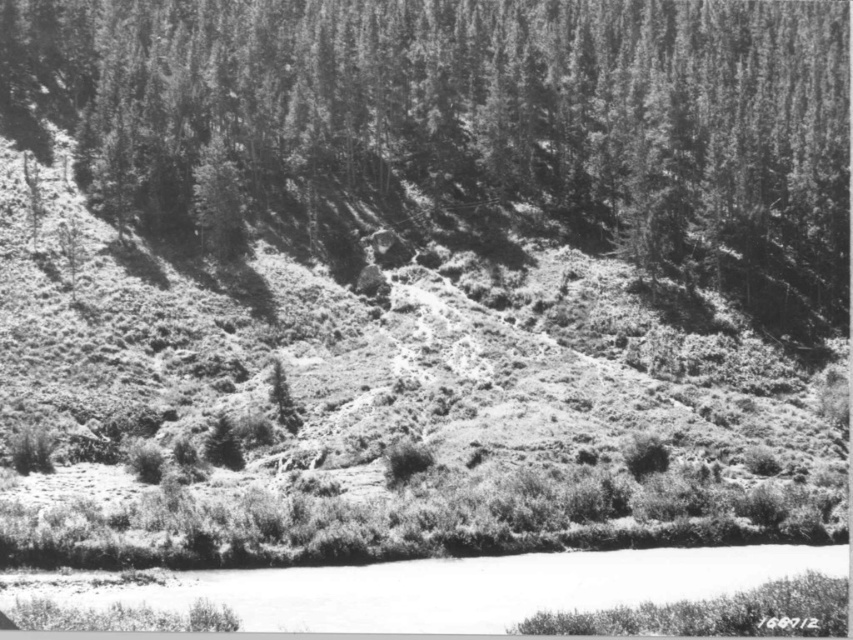
Consider the image. Which of these two, grassy hillside at center or white smooth water at lower center, stands shorter?

white smooth water at lower center

Between grassy hillside at center and white smooth water at lower center, which one appears on the left side from the viewer's perspective?

grassy hillside at center is more to the left.

Between point (187, 522) and point (799, 570), which one is positioned behind?

The point (187, 522) is behind.

The width and height of the screenshot is (853, 640). Find the location of `grassy hillside at center`. grassy hillside at center is located at coordinates (373, 404).

In the scene shown: Who is positioned more to the right, grassy hillside at center or smooth bark tree at upper center?

smooth bark tree at upper center

Is grassy hillside at center thinner than smooth bark tree at upper center?

Yes, grassy hillside at center is thinner than smooth bark tree at upper center.

Which is behind, point (389, 376) or point (438, 40)?

The point (438, 40) is more distant.

Where is `grassy hillside at center`? grassy hillside at center is located at coordinates (373, 404).

Can you confirm if smooth bark tree at upper center is wider than white smooth water at lower center?

Yes, smooth bark tree at upper center is wider than white smooth water at lower center.

The image size is (853, 640). I want to click on smooth bark tree at upper center, so pyautogui.click(x=485, y=108).

Is point (569, 132) less distant than point (167, 572)?

No, (569, 132) is behind (167, 572).

Where is `smooth bark tree at upper center`? smooth bark tree at upper center is located at coordinates (485, 108).